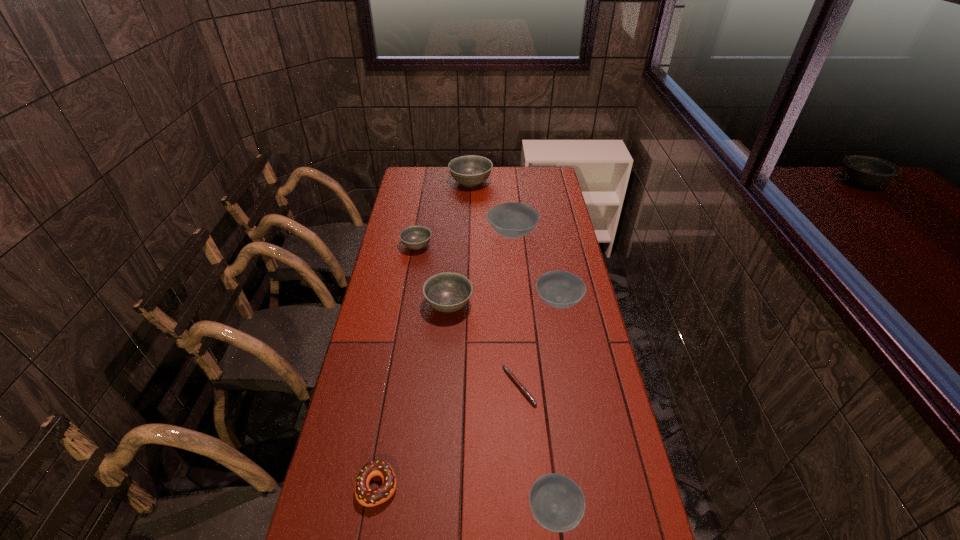
Identify the location of bowl present at the left edge. The width and height of the screenshot is (960, 540). (414, 237).

This screenshot has width=960, height=540. I want to click on doughnut positioned at the left edge, so click(365, 496).

The height and width of the screenshot is (540, 960). I want to click on vacant space at the left edge, so click(x=380, y=284).

You are a GUI agent. You are given a task and a screenshot of the screen. Output one action in this format:
    pyautogui.click(x=<x>, y=<y>)
    Task: Click on the free region at the right edge of the desktop
    
    Given the screenshot: What is the action you would take?
    pyautogui.click(x=590, y=359)

Locate an element on the screen. The width and height of the screenshot is (960, 540). free space at the far left corner is located at coordinates (419, 185).

Image resolution: width=960 pixels, height=540 pixels. What are the coordinates of `free space between the smallest gray bowl and the farthest brown bowl` in the screenshot? It's located at (465, 240).

The image size is (960, 540). I want to click on vacant area that lies between the doughnut and the second nearest gray bowl, so click(397, 366).

Image resolution: width=960 pixels, height=540 pixels. I want to click on free space between the seventh tallest object and the farthest bowl, so click(424, 334).

Locate an element on the screen. free space between the second nearest gray bowl and the shortest object is located at coordinates (468, 316).

The height and width of the screenshot is (540, 960). In order to click on vacant area that lies between the second nearest gray bowl and the farthest brown bowl in this screenshot , I will do `click(465, 240)`.